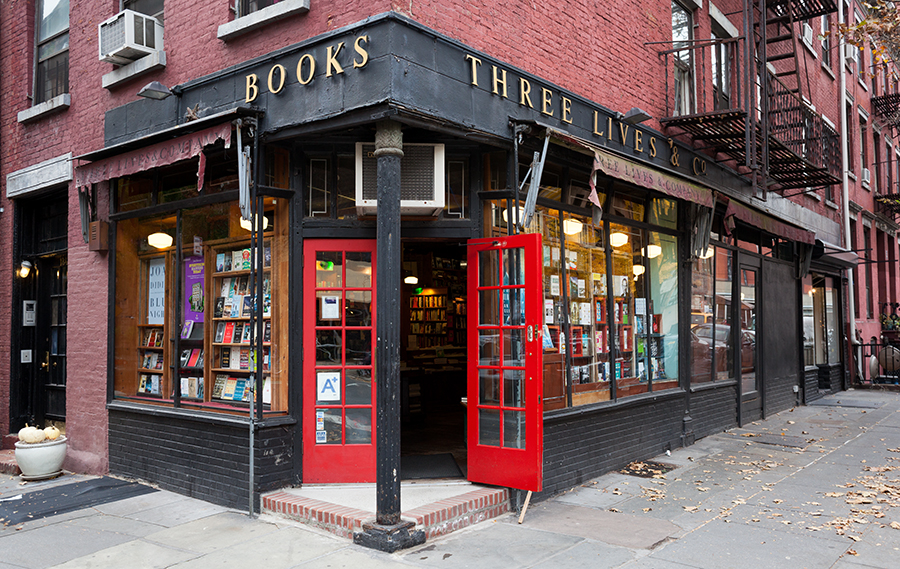
Locate an element on the screen. The image size is (900, 569). left door is located at coordinates (339, 459).